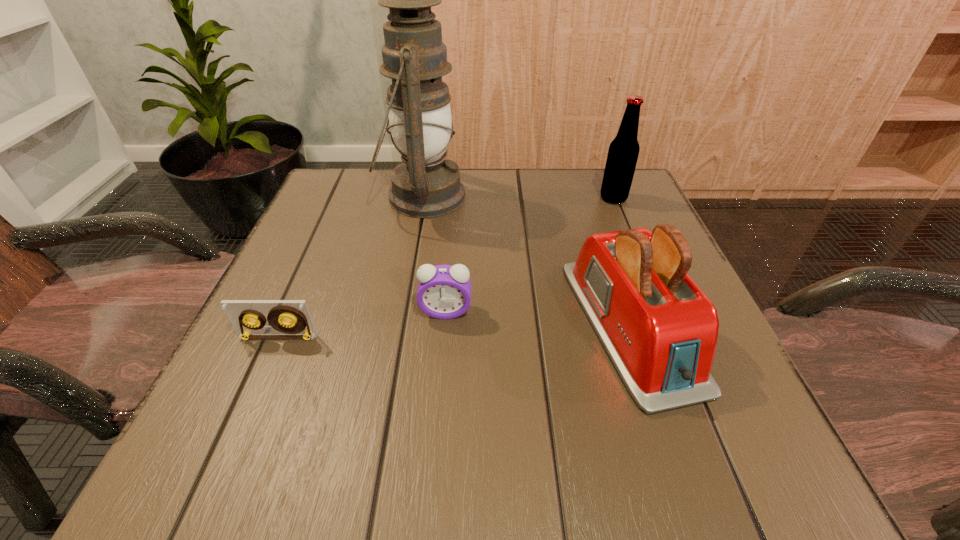
This screenshot has height=540, width=960. Identify the location of vacant space located 0.050m at the front of the videotape with visible reels. click(x=265, y=367).

Where is `oil lamp that is at the far edge`? oil lamp that is at the far edge is located at coordinates (x=425, y=185).

This screenshot has height=540, width=960. What are the coordinates of `beer bottle present at the far edge` in the screenshot? It's located at (623, 152).

Find the location of `oil lamp that is at the left edge`. oil lamp that is at the left edge is located at coordinates (425, 185).

The height and width of the screenshot is (540, 960). I want to click on videotape that is positioned at the left edge, so [x=240, y=312].

The image size is (960, 540). I want to click on beer bottle present at the right edge, so click(623, 152).

This screenshot has width=960, height=540. I want to click on toaster that is at the right edge, so click(660, 330).

Locate an element on the screen. Image resolution: width=960 pixels, height=540 pixels. object that is at the far left corner is located at coordinates (425, 185).

I want to click on object that is at the far right corner, so click(x=623, y=152).

This screenshot has height=540, width=960. I want to click on vacant space at the far edge, so click(515, 206).